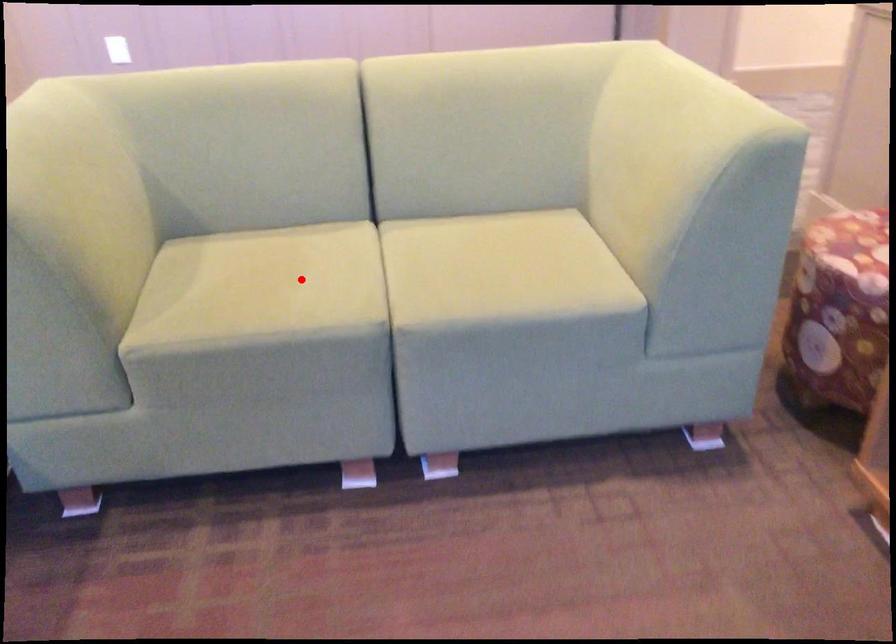
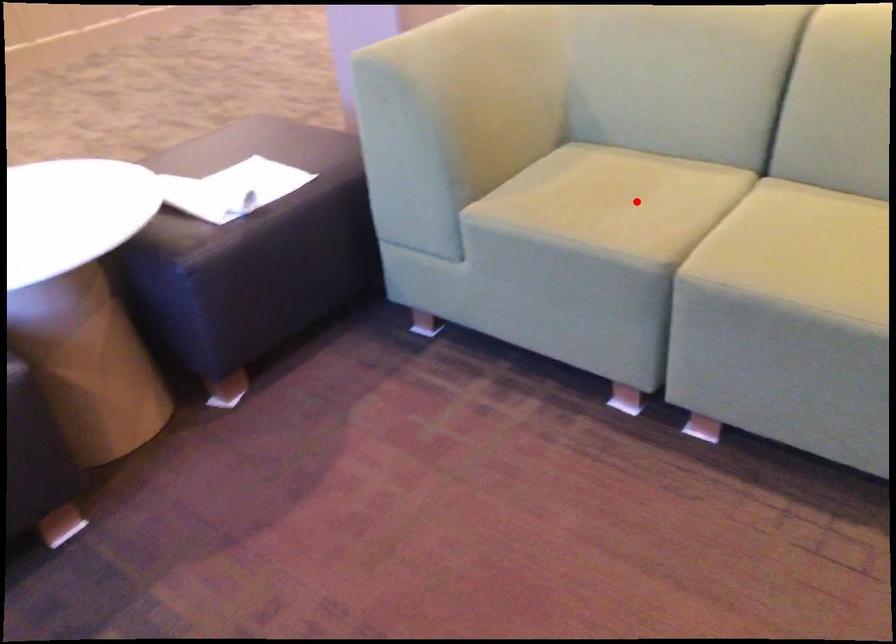
I am providing you with two images of the same scene from different viewpoints. A red point is marked on the first image and another point is marked on the second image. Do the highlighted points in image1 and image2 indicate the same real-world spot?

Yes